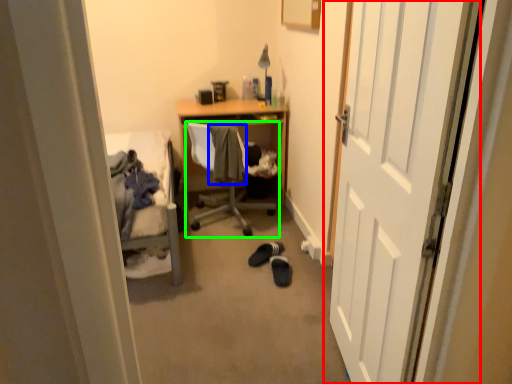
Question: Which object is the closest to the door (highlighted by a red box)? Choose among these: clothing (highlighted by a blue box) or chair (highlighted by a green box).

Choices:
 (A) clothing
 (B) chair

Answer: (A)